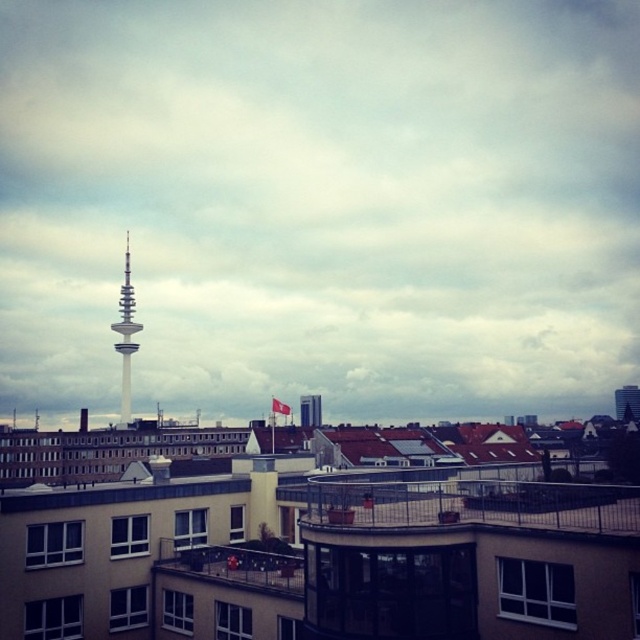
Consider the image. You are a city planner reviewing the city layout. You need to determine the relative positions of the silver metallic tower at center and the white glass tv tower at center. Which tower is positioned to the left?

The silver metallic tower at center is positioned to the left of the white glass tv tower at center.

You are standing at the point marked by the coordinates point (125, 336) in the cityscape. Looking around, you notice the curved balcony with glass railings in the lower right corner. Which direction should you face to see the curved balcony with glass railings?

The point (125, 336) corresponds to the silver metallic tower at center. To see the curved balcony with glass railings in the lower right corner, you should face towards the lower right direction from the silver metallic tower at center.